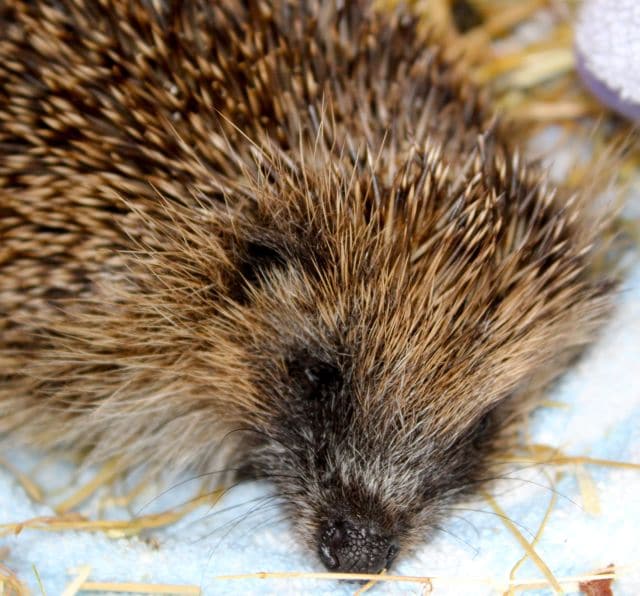
The height and width of the screenshot is (596, 640). In order to click on towel in this screenshot , I will do `click(81, 555)`, `click(461, 574)`, `click(619, 387)`, `click(544, 133)`.